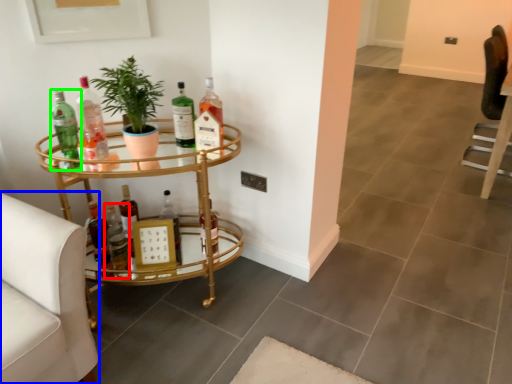
Question: Estimate the real-world distances between objects in this image. Which object is closer to bottle (highlighted by a red box), swivel chair (highlighted by a blue box) or bottle (highlighted by a green box)?

Choices:
 (A) swivel chair
 (B) bottle

Answer: (B)